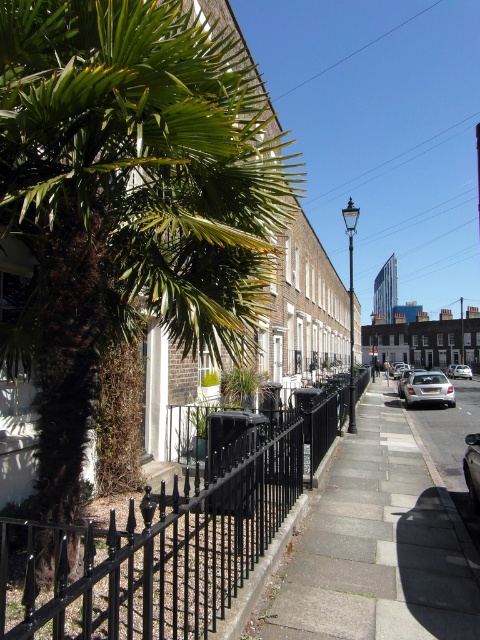
You are a pedestrian standing on the sidewalk and want to cross the street to reach a store across. The silver metallic car at center is blocking your path. Can you walk around the car to get to the gray concrete pavement at center?

The gray concrete pavement at center is in front of the silver metallic car at center, so the car is between you and the pavement. You cannot walk around the car to reach the gray concrete pavement at center because the pavement is already in front of the car, meaning the car is blocking your path.

You are a delivery person trying to navigate a narrow sidewalk. You see the green leafy palm tree at left and the gray concrete pavement at center. Which object is positioned higher relative to the other?

The green leafy palm tree at left is located above the gray concrete pavement at center, so it is positioned higher.

You are standing at the point marked as point (375, 545) in the image. What material are you standing on?

You are standing on gray concrete pavement at center.